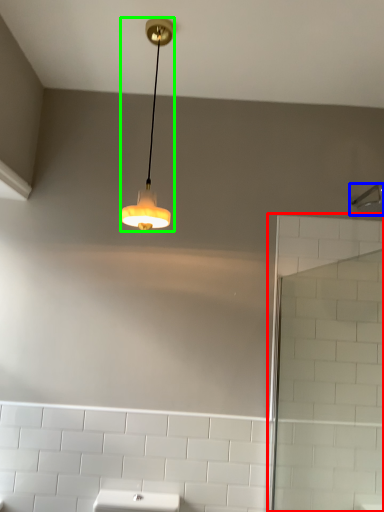
Question: Based on their relative distances, which object is nearer to screen door (highlighted by a red box)? Choose from shower (highlighted by a blue box) and lamp (highlighted by a green box).

Choices:
 (A) shower
 (B) lamp

Answer: (A)